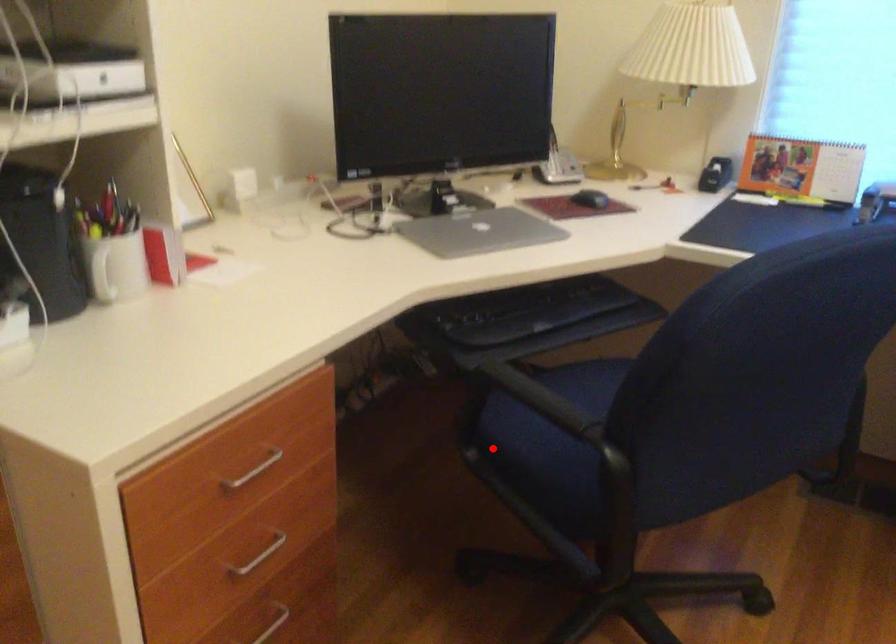
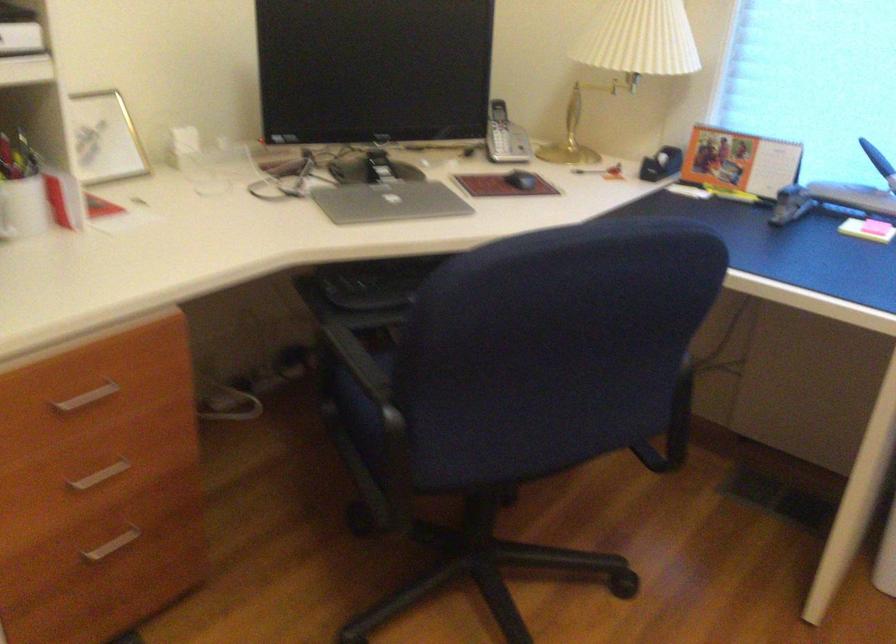
The point at the highlighted location is marked in the first image. Where is the corresponding point in the second image?

(352, 404)